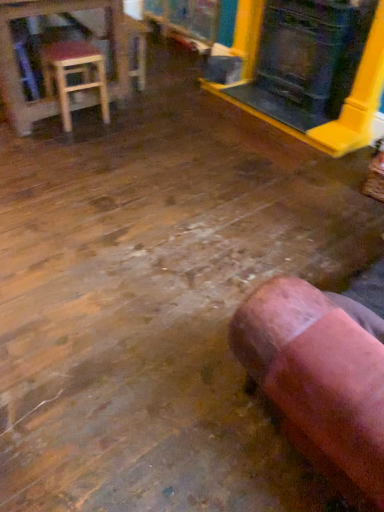
Question: From the image's perspective, is wooden stool at left located beneath pink suede bean bag chair at lower right?

Choices:
 (A) no
 (B) yes

Answer: (A)

Question: Does wooden stool at left lie behind pink suede bean bag chair at lower right?

Choices:
 (A) yes
 (B) no

Answer: (A)

Question: Is wooden stool at left bigger than pink suede bean bag chair at lower right?

Choices:
 (A) yes
 (B) no

Answer: (B)

Question: Is pink suede bean bag chair at lower right surrounded by wooden stool at left?

Choices:
 (A) no
 (B) yes

Answer: (A)

Question: Is wooden stool at left not within pink suede bean bag chair at lower right?

Choices:
 (A) no
 (B) yes

Answer: (B)

Question: Considering their positions, is pink suede bean bag chair at lower right located in front of or behind matte black fireplace at upper right?

Choices:
 (A) front
 (B) behind

Answer: (A)

Question: Considering the relative positions of pink suede bean bag chair at lower right and matte black fireplace at upper right in the image provided, is pink suede bean bag chair at lower right to the left or to the right of matte black fireplace at upper right?

Choices:
 (A) right
 (B) left

Answer: (B)

Question: In terms of height, does pink suede bean bag chair at lower right look taller or shorter compared to matte black fireplace at upper right?

Choices:
 (A) tall
 (B) short

Answer: (B)

Question: Looking at their shapes, would you say pink suede bean bag chair at lower right is wider or thinner than matte black fireplace at upper right?

Choices:
 (A) thin
 (B) wide

Answer: (B)

Question: Considering their positions, is wooden stool at upper left located in front of or behind matte black fireplace at upper right?

Choices:
 (A) behind
 (B) front

Answer: (A)

Question: In the image, is wooden stool at upper left on the left side or the right side of matte black fireplace at upper right?

Choices:
 (A) left
 (B) right

Answer: (A)

Question: From the image's perspective, is wooden stool at upper left located above or below matte black fireplace at upper right?

Choices:
 (A) above
 (B) below

Answer: (A)

Question: Do you think wooden stool at upper left is within matte black fireplace at upper right, or outside of it?

Choices:
 (A) outside
 (B) inside

Answer: (A)

Question: Do you think matte black fireplace at upper right is within wooden stool at left, or outside of it?

Choices:
 (A) inside
 (B) outside

Answer: (B)

Question: From a real-world perspective, is matte black fireplace at upper right positioned above or below wooden stool at left?

Choices:
 (A) below
 (B) above

Answer: (B)